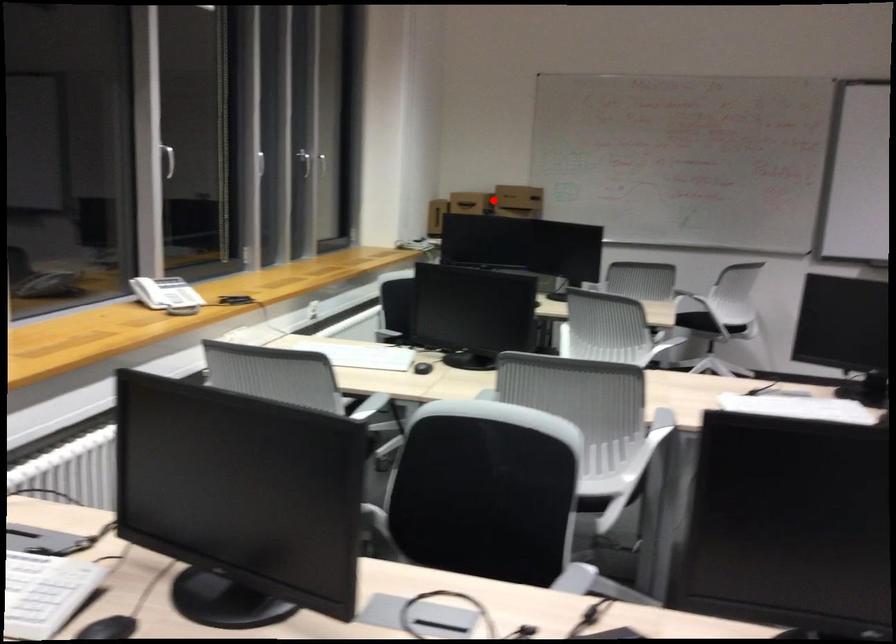
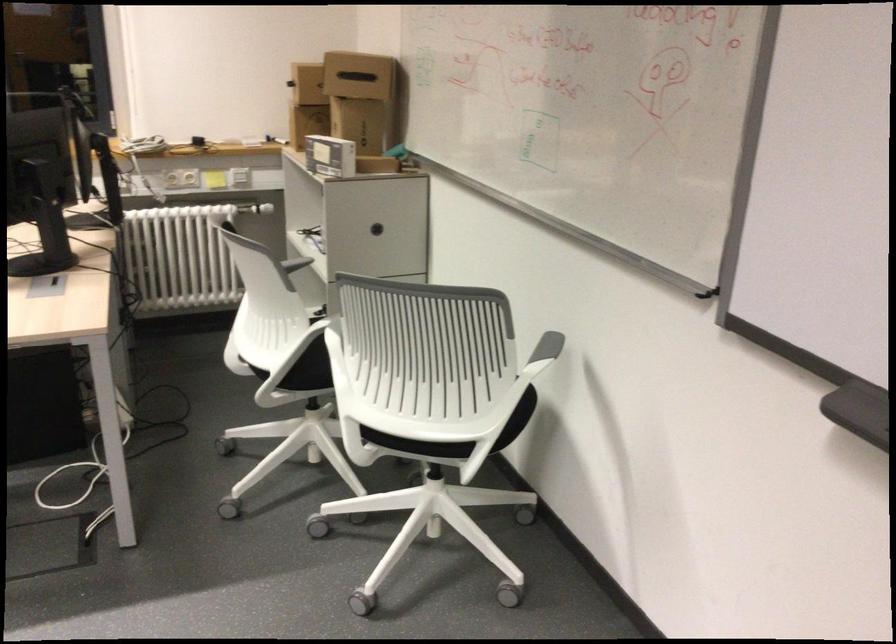
Locate, in the second image, the point that corresponds to the highlighted location in the first image.

(307, 84)